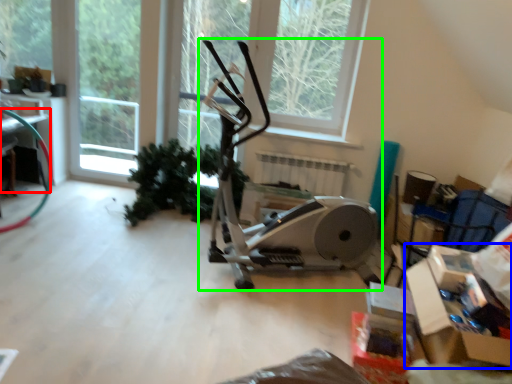
Question: Based on their relative distances, which object is farther from table (highlighted by a red box)? Choose from cardboard box (highlighted by a blue box) and stationary bicycle (highlighted by a green box).

Choices:
 (A) cardboard box
 (B) stationary bicycle

Answer: (A)